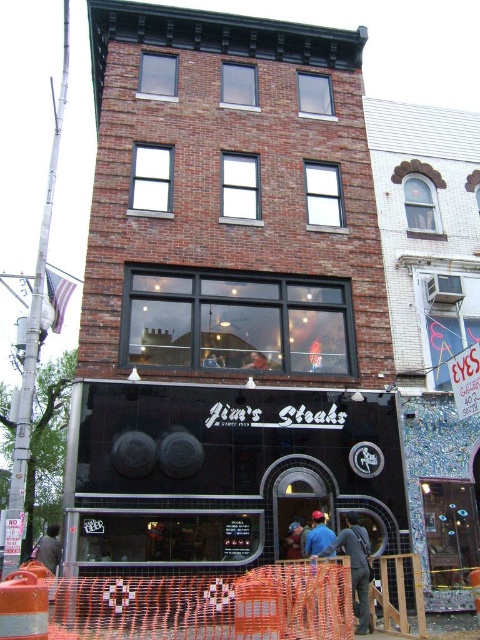
Is point (175, 417) farther from camera compared to point (352, 522)?

Yes, it is behind point (352, 522).

The image size is (480, 640). What do you see at coordinates (222, 474) in the screenshot?
I see `black glass storefront at center` at bounding box center [222, 474].

Identify the location of black glass storefront at center. (222, 474).